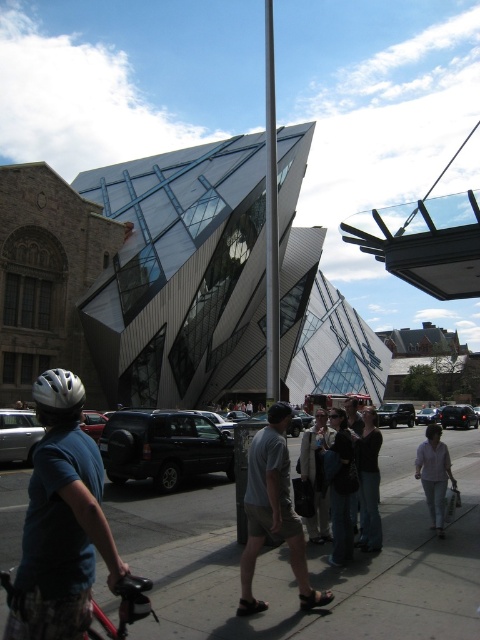
Between metallic glass pole at center and dark gray sweater at center, which one appears on the right side from the viewer's perspective?

metallic glass pole at center

Can you confirm if metallic glass pole at center is wider than dark gray sweater at center?

Yes, metallic glass pole at center is wider than dark gray sweater at center.

Which is in front, point (266, 131) or point (381, 532)?

Positioned in front is point (381, 532).

This screenshot has height=640, width=480. In order to click on metallic glass pole at center in this screenshot , I will do `click(271, 220)`.

Is glassy steel building at center to the right of gray concrete sidewalk at center from the viewer's perspective?

In fact, glassy steel building at center is to the left of gray concrete sidewalk at center.

From the picture: Can you confirm if glassy steel building at center is positioned above gray concrete sidewalk at center?

Yes, glassy steel building at center is above gray concrete sidewalk at center.

Between point (79, 310) and point (408, 625), which one is positioned behind?

Point (79, 310)

At what (x,y) coordinates should I click in order to perform the action: click on glassy steel building at center. Please return your answer as a coordinate pair (x, y). This screenshot has width=480, height=640. Looking at the image, I should click on (153, 284).

Does glassy steel building at center appear over red matte bicycle at lower left?

Correct, glassy steel building at center is located above red matte bicycle at lower left.

Is glassy steel building at center wider than red matte bicycle at lower left?

Correct, the width of glassy steel building at center exceeds that of red matte bicycle at lower left.

Is point (216, 392) positioned behind point (134, 577)?

Yes, point (216, 392) is farther from viewer.

You are a GUI agent. You are given a task and a screenshot of the screen. Output one action in this format:
    pyautogui.click(x=<x>, y=<y>)
    Task: Click on the glassy steel building at center
    This screenshot has width=480, height=640.
    Given the screenshot: What is the action you would take?
    pyautogui.click(x=153, y=284)